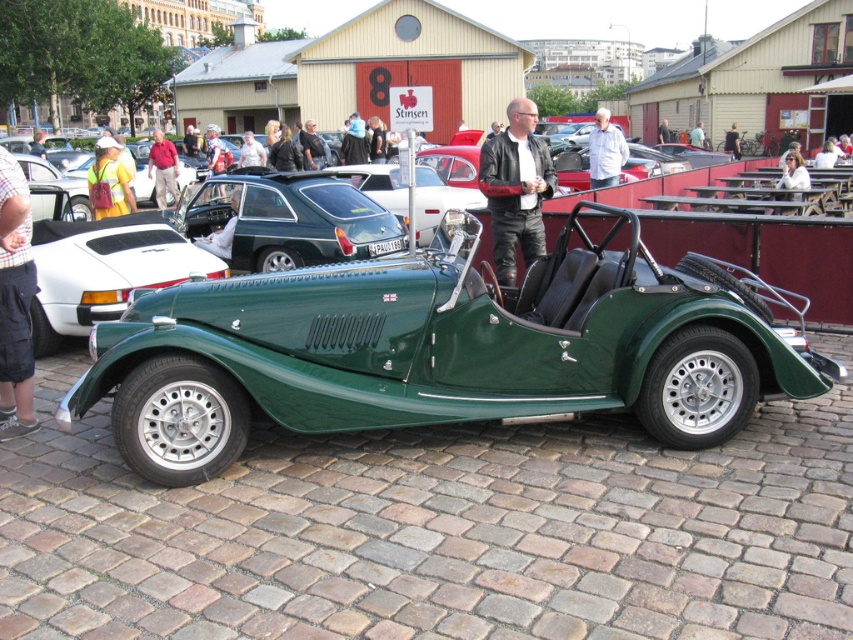
You are at a car show and see two jackets displayed on mannequins near the vintage green Morgan sports car. The jackets are the white leather jacket at upper center and the dark gray leather jacket at center. Which jacket is positioned closer to you?

The white leather jacket at upper center is closer to the viewer than the dark gray leather jacket at center.

You are a tailor observing the jackets in the image. Which jacket has a wider width between the white leather jacket at upper center and the dark gray leather jacket at center?

The dark gray leather jacket at center has a wider width than the white leather jacket at upper center.

From the picture: You are a photographer at a car show and need to place a leather jacket at center and a reflective yellow safety vest at left in your shot. Which object should you adjust to ensure both fit within the frame?

The leather jacket at center is smaller than the reflective yellow safety vest at left, so you should adjust the position of the reflective yellow safety vest at left to ensure both fit within the frame since it takes up more space.